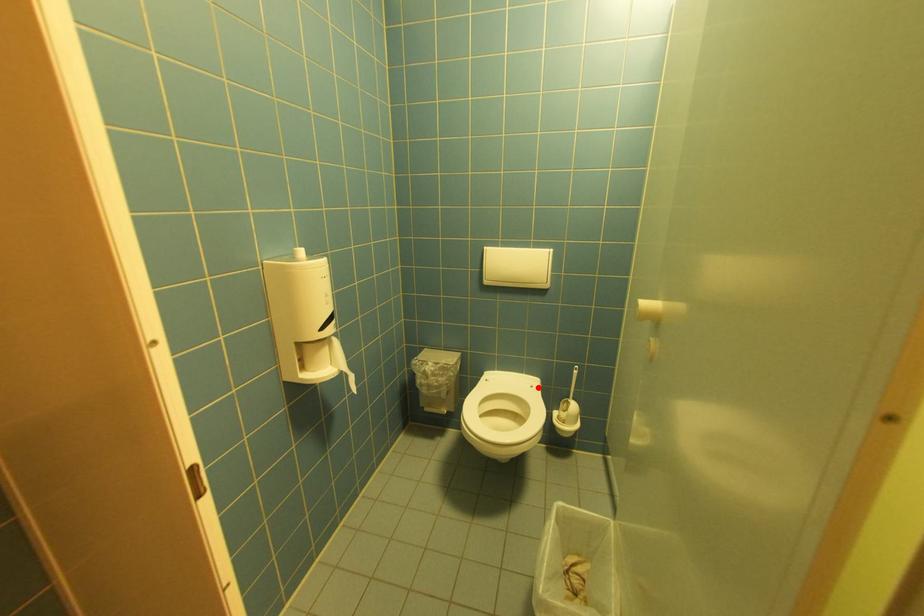
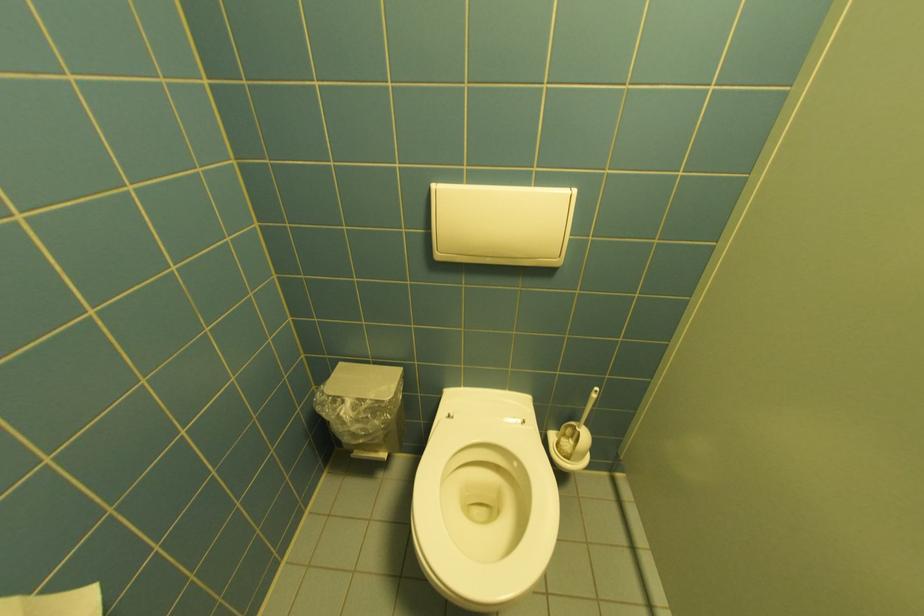
Find the pixel in the second image that matches the highlighted location in the first image.

(529, 424)